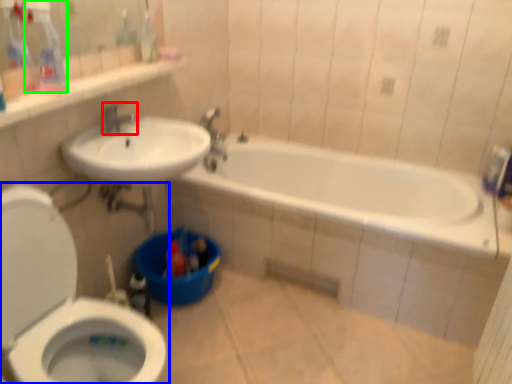
Question: Considering the real-world distances, which object is closest to tap (highlighted by a red box)? toilet (highlighted by a blue box) or cleaning product (highlighted by a green box).

Choices:
 (A) toilet
 (B) cleaning product

Answer: (B)